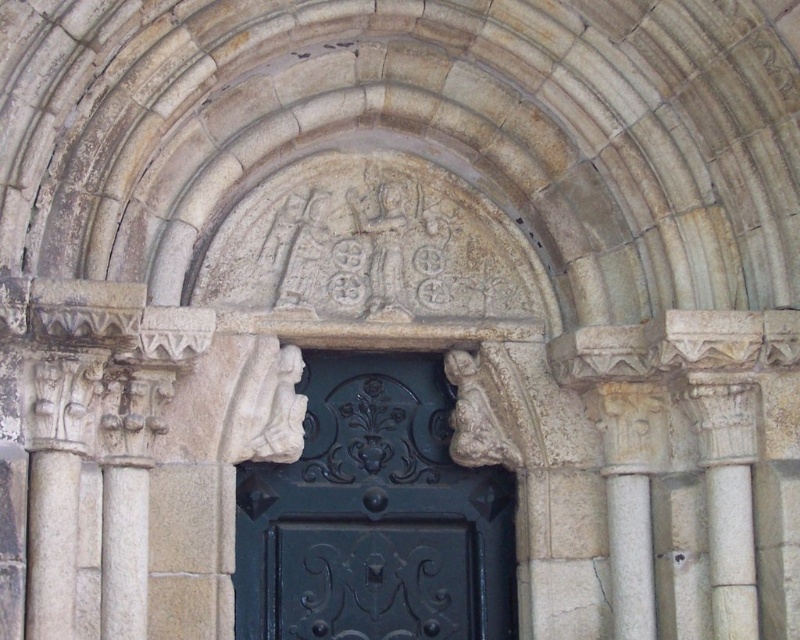
Question: Considering the relative positions of green polished wood door at center and white stone column at left in the image provided, where is green polished wood door at center located with respect to white stone column at left?

Choices:
 (A) right
 (B) left

Answer: (A)

Question: Does green polished wood door at center come behind white stone column at left?

Choices:
 (A) yes
 (B) no

Answer: (A)

Question: Which point appears farthest from the camera in this image?

Choices:
 (A) (x=108, y=476)
 (B) (x=420, y=353)

Answer: (B)

Question: Is the position of green polished wood door at center less distant than that of white stone column at left?

Choices:
 (A) no
 (B) yes

Answer: (A)